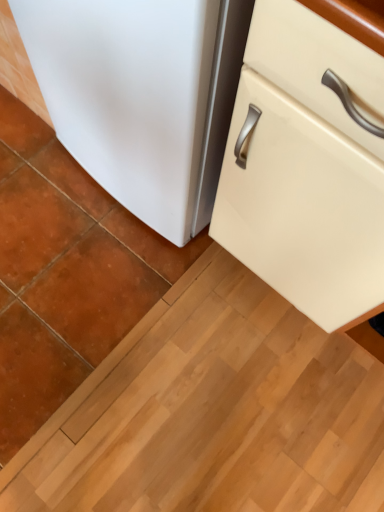
Question: From the image's perspective, is matte cream cabinet at lower right on top of white matte refrigerator at lower left?

Choices:
 (A) yes
 (B) no

Answer: (B)

Question: Considering the relative positions of matte cream cabinet at lower right and white matte refrigerator at lower left in the image provided, is matte cream cabinet at lower right to the left of white matte refrigerator at lower left from the viewer's perspective?

Choices:
 (A) yes
 (B) no

Answer: (B)

Question: From the image's perspective, is matte cream cabinet at lower right under white matte refrigerator at lower left?

Choices:
 (A) yes
 (B) no

Answer: (A)

Question: Is white matte refrigerator at lower left at the back of matte cream cabinet at lower right?

Choices:
 (A) yes
 (B) no

Answer: (B)

Question: Would you say matte cream cabinet at lower right contains white matte refrigerator at lower left?

Choices:
 (A) no
 (B) yes

Answer: (A)

Question: Is matte cream cabinet at lower right at the right side of white matte refrigerator at lower left?

Choices:
 (A) yes
 (B) no

Answer: (A)

Question: From the image's perspective, does white matte refrigerator at lower left appear higher than matte cream cabinet at lower right?

Choices:
 (A) yes
 (B) no

Answer: (A)

Question: Is white matte refrigerator at lower left closer to the viewer compared to matte cream cabinet at lower right?

Choices:
 (A) yes
 (B) no

Answer: (B)

Question: From a real-world perspective, is white matte refrigerator at lower left on matte cream cabinet at lower right?

Choices:
 (A) no
 (B) yes

Answer: (A)

Question: Does white matte refrigerator at lower left have a larger size compared to matte cream cabinet at lower right?

Choices:
 (A) no
 (B) yes

Answer: (A)

Question: Does white matte refrigerator at lower left lie behind matte cream cabinet at lower right?

Choices:
 (A) yes
 (B) no

Answer: (A)

Question: Is white matte refrigerator at lower left not close to matte cream cabinet at lower right?

Choices:
 (A) no
 (B) yes

Answer: (A)

Question: From the image's perspective, relative to matte cream cabinet at lower right, is white matte refrigerator at lower left above or below?

Choices:
 (A) above
 (B) below

Answer: (A)